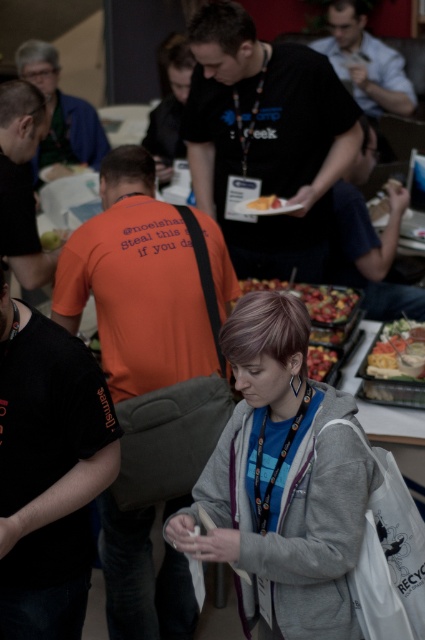
Question: Can you confirm if white plastic tray at center is positioned above yellow matte cake at center?

Choices:
 (A) no
 (B) yes

Answer: (A)

Question: Among these objects, which one is farthest from the camera?

Choices:
 (A) smooth plastic apples at center
 (B) yellow matte cake at center
 (C) white plastic tray at center

Answer: (B)

Question: Which object appears farthest from the camera in this image?

Choices:
 (A) smooth plastic apples at center
 (B) smooth plastic tray at center
 (C) yellow matte cake at center

Answer: (C)

Question: Which point is farther to the camera?

Choices:
 (A) (309, 348)
 (B) (416, 369)
 (C) (263, 200)
 (D) (337, 596)

Answer: (C)

Question: Does smooth plastic apples at center appear on the left side of yellow matte cake at center?

Choices:
 (A) yes
 (B) no

Answer: (B)

Question: Is gray fleece jacket at center behind smooth plastic apples at center?

Choices:
 (A) yes
 (B) no

Answer: (B)